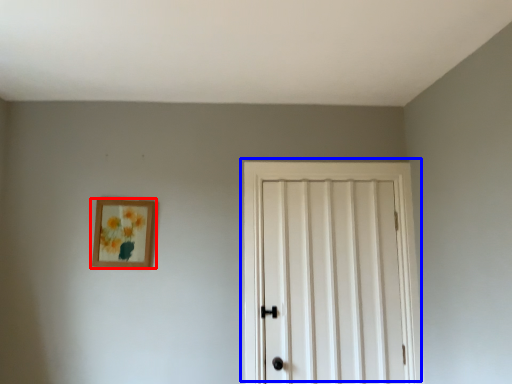
Question: Which of the following is the closest to the observer, picture frame (highlighted by a red box) or door (highlighted by a blue box)?

Choices:
 (A) picture frame
 (B) door

Answer: (B)